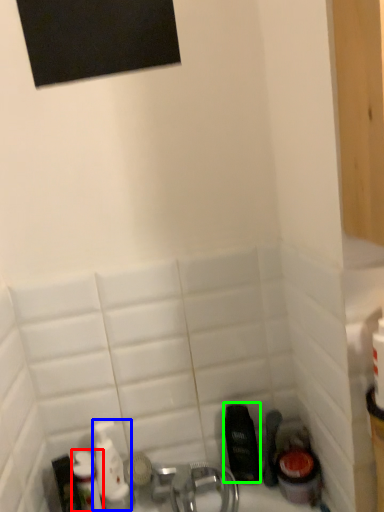
Question: Which is farther away from toiletry (highlighted by a red box)? mouthwash (highlighted by a blue box) or mouthwash (highlighted by a green box)?

Choices:
 (A) mouthwash
 (B) mouthwash

Answer: (B)